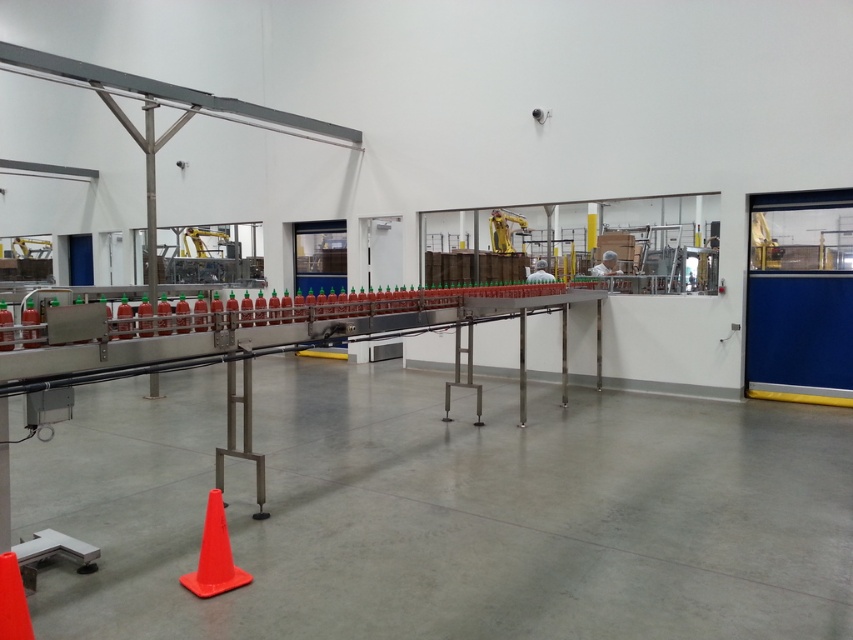
You are an inspector in the bottling facility. You need to check the height of the orange matte traffic cone at lower left and the orange matte traffic cone at center. Which one is taller?

The orange matte traffic cone at lower left is taller than the orange matte traffic cone at center according to the description.

Based on the photo, you are an inspector in the bottling facility and need to locate the orange matte traffic cone at lower left. Where would you find it in relation to the orange matte traffic cone at center?

The orange matte traffic cone at lower left is positioned under the orange matte traffic cone at center, meaning it is directly beneath it from the observer perspective.